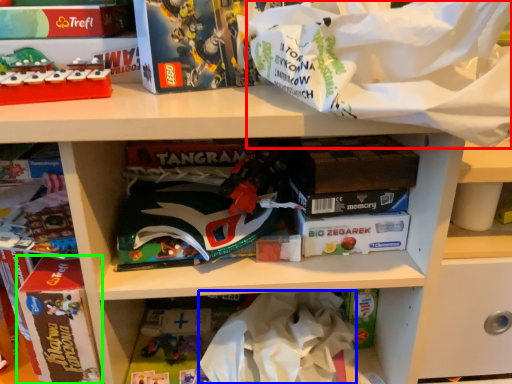
Question: Which is farther away from material (highlighted by a red box)? clothing (highlighted by a blue box) or paperback book (highlighted by a green box)?

Choices:
 (A) clothing
 (B) paperback book

Answer: (B)